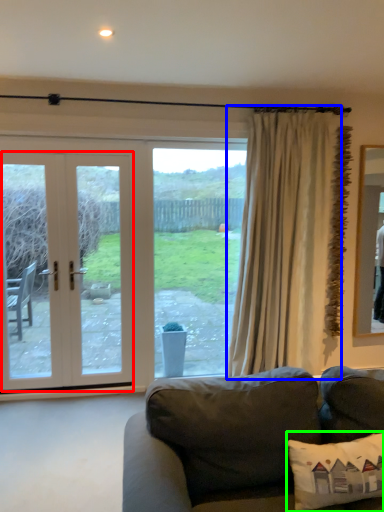
Question: Based on their relative distances, which object is nearer to door (highlighted by a red box)? Choose from curtain (highlighted by a blue box) and pillow (highlighted by a green box).

Choices:
 (A) curtain
 (B) pillow

Answer: (A)